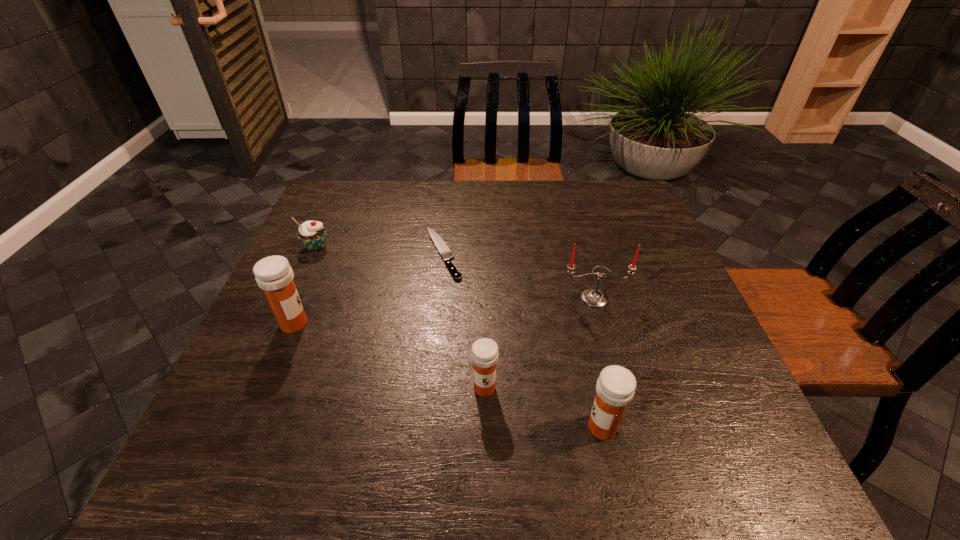
I want to click on vacant space at the far edge of the desktop, so click(x=396, y=212).

In the image, there is a desktop. Identify the location of blank space at the left edge. (258, 338).

Locate an element on the screen. vacant space at the right edge of the desktop is located at coordinates (665, 313).

Locate an element on the screen. vacant point at the far right corner is located at coordinates (592, 195).

I want to click on empty space between the nearest object and the farthest medicine, so click(x=448, y=375).

Image resolution: width=960 pixels, height=540 pixels. What are the coordinates of `blank region between the candle and the steak knife` in the screenshot? It's located at pos(519,275).

The width and height of the screenshot is (960, 540). Find the location of `empty location between the farthest medicine and the fifth farthest object`. empty location between the farthest medicine and the fifth farthest object is located at coordinates (389, 356).

Locate an element on the screen. The image size is (960, 540). unoccupied area between the rightmost medicine and the leftmost medicine is located at coordinates (448, 375).

What are the coordinates of `empty space that is in between the shortest object and the shortest medicine` in the screenshot? It's located at (464, 320).

What are the coordinates of `empty location between the candle and the shortest medicine` in the screenshot? It's located at (540, 343).